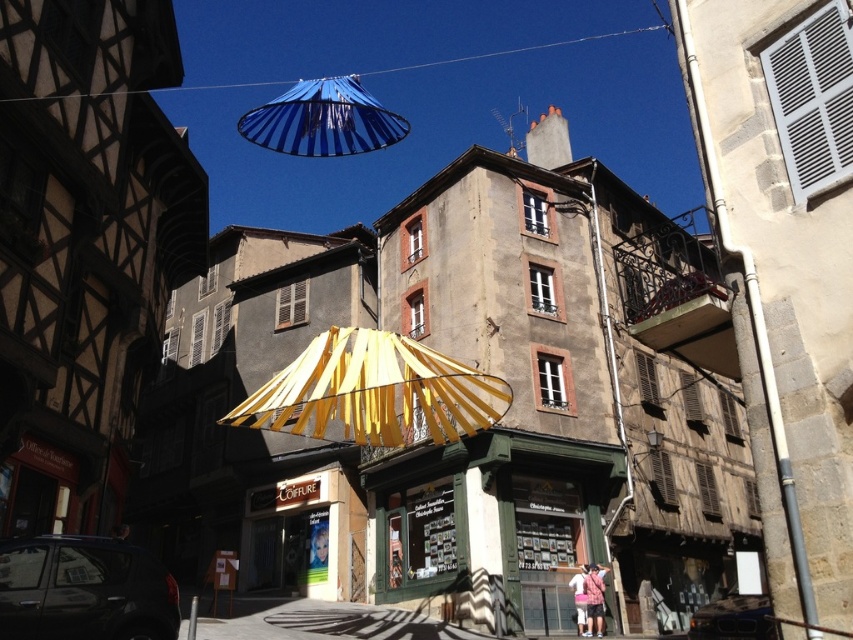
Image resolution: width=853 pixels, height=640 pixels. Identify the location of green wooden shop at center. (488, 516).

Is green wooden shop at center thinner than yellow fabric umbrella at center?

Yes, green wooden shop at center is thinner than yellow fabric umbrella at center.

Describe the element at coordinates (488, 516) in the screenshot. This screenshot has height=640, width=853. I see `green wooden shop at center` at that location.

Locate an element on the screen. The image size is (853, 640). green wooden shop at center is located at coordinates (488, 516).

Between green wooden shop at center and blue striped canopy at upper center, which one appears on the right side from the viewer's perspective?

From the viewer's perspective, green wooden shop at center appears more on the right side.

Where is `green wooden shop at center`? The height and width of the screenshot is (640, 853). green wooden shop at center is located at coordinates (488, 516).

The image size is (853, 640). What do you see at coordinates (488, 516) in the screenshot? I see `green wooden shop at center` at bounding box center [488, 516].

The image size is (853, 640). I want to click on green wooden shop at center, so click(488, 516).

The height and width of the screenshot is (640, 853). What are the coordinates of `yellow fabric umbrella at center` in the screenshot? It's located at click(374, 392).